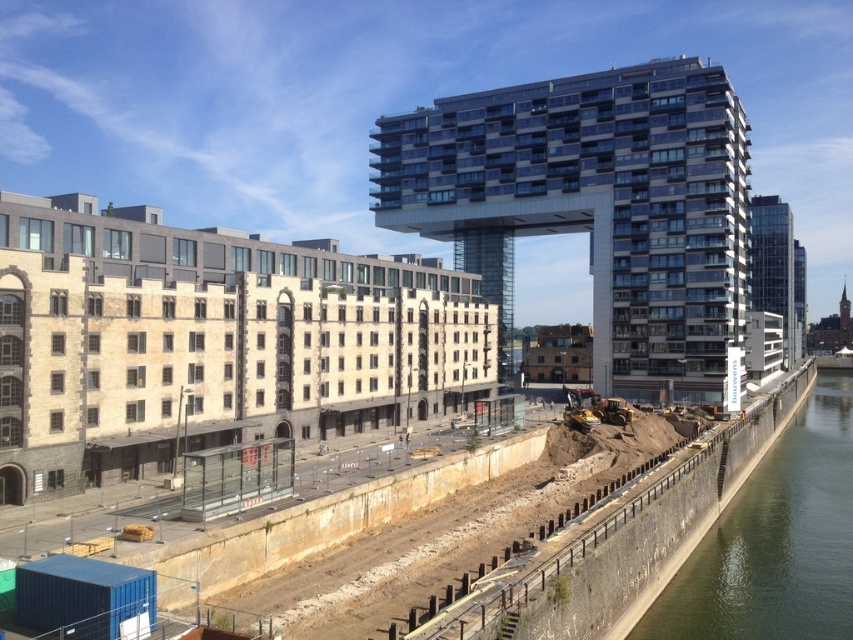
Can you confirm if beige stone building at center is bigger than glassy modern building at right?

No, beige stone building at center is not bigger than glassy modern building at right.

Image resolution: width=853 pixels, height=640 pixels. What do you see at coordinates (212, 342) in the screenshot? I see `beige stone building at center` at bounding box center [212, 342].

Find the location of a particular element. This screenshot has width=853, height=640. beige stone building at center is located at coordinates (212, 342).

Between brown dirt at lower center and glassy modern building at right, which one has more height?

glassy modern building at right is taller.

Which is behind, point (758, 436) or point (785, 268)?

Point (785, 268)

The width and height of the screenshot is (853, 640). What do you see at coordinates (631, 554) in the screenshot?
I see `brown dirt at lower center` at bounding box center [631, 554].

Find the location of a particular element. brown dirt at lower center is located at coordinates (631, 554).

Is glassy steel building at center smaller than glassy modern building at right?

No.

You are a GUI agent. You are given a task and a screenshot of the screen. Output one action in this format:
    pyautogui.click(x=<x>, y=<y>)
    Task: Click on the glassy steel building at center
    The height and width of the screenshot is (640, 853).
    Given the screenshot: What is the action you would take?
    pyautogui.click(x=595, y=205)